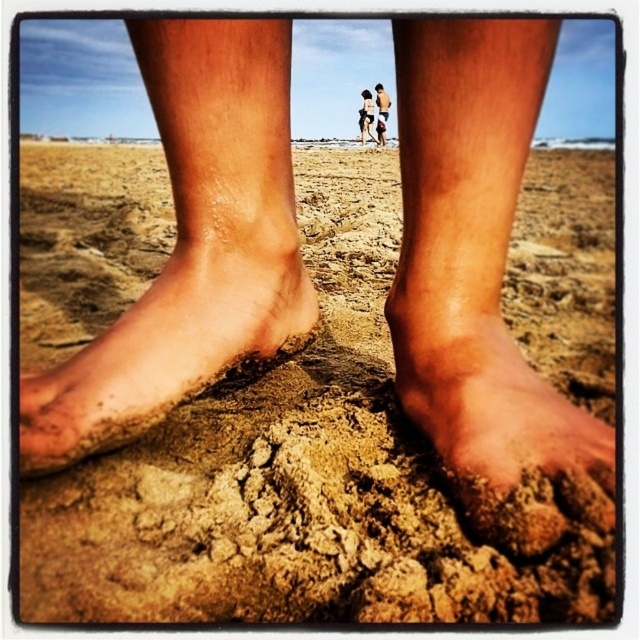
Consider the image. You are standing at the origin point of the coordinate system. You want to place a small flag at the dry sand at center. What are the coordinates where you should place the flag?

The coordinates for placing the flag at the dry sand at center are at point [294,480].

You are standing at the point marked by the coordinates point [168,346]. Looking towards the two figures walking away, are they moving towards the ocean or away from it?

The two figures are walking away from the camera, which is positioned at the point marked by the coordinates point [168,346]. Since the camera is at the point where the feet are, the figures are moving towards the horizon, which is the ocean direction. Therefore, they are moving towards the ocean.

You are standing on the beach and see your two feet in the image. The dusty sand foot at lower left and the smooth tan skin at center are both visible. Which foot is positioned more to the left side of your view?

The dusty sand foot at lower left is positioned more to the left side of your view compared to the smooth tan skin at center.